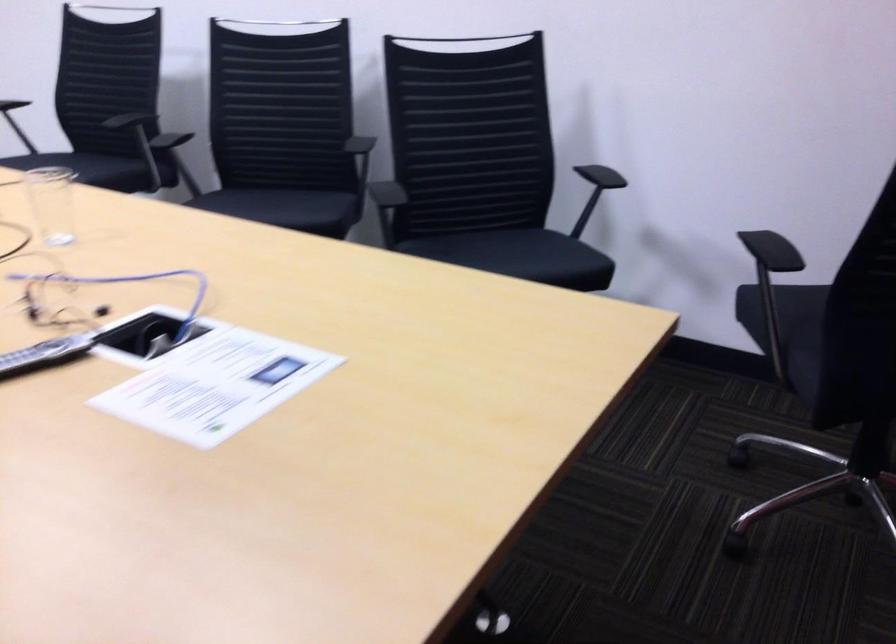
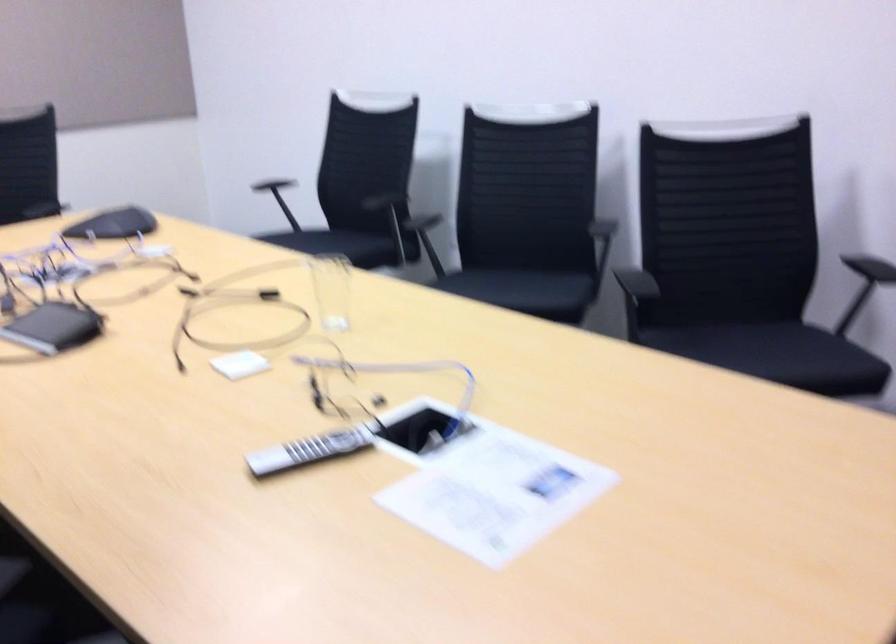
Locate, in the second image, the point that corresponds to (x=289, y=207) in the first image.

(528, 289)